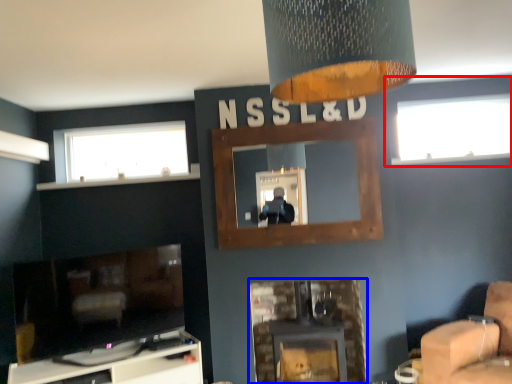
Question: Which object appears farthest to the camera in this image, window (highlighted by a red box) or fireplace (highlighted by a blue box)?

Choices:
 (A) window
 (B) fireplace

Answer: (A)